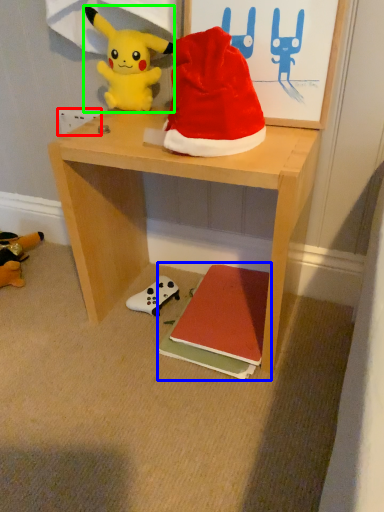
Question: Considering the real-world distances, which object is farthest from power outlet (highlighted by a red box)? book (highlighted by a blue box) or toy (highlighted by a green box)?

Choices:
 (A) book
 (B) toy

Answer: (A)